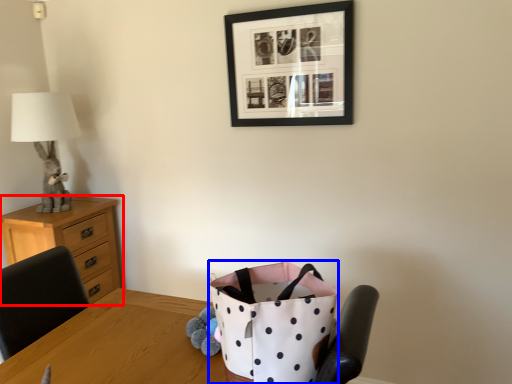
Question: Which object appears farthest to the camera in this image, chest of drawers (highlighted by a red box) or shopping bag (highlighted by a blue box)?

Choices:
 (A) chest of drawers
 (B) shopping bag

Answer: (A)